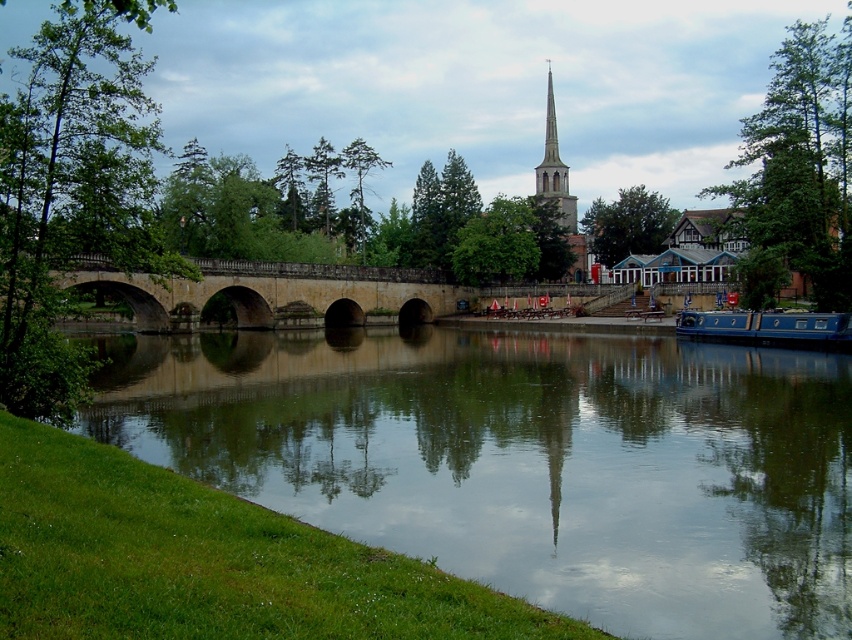
You are standing at the point with coordinates of 0.5, 0.3. Which object is closest to you? The stone bridge at center or the church?

The stone bridge at center is closest because it is located at point (273, 292), which is closer to your position at (255, 320) than the church.

Consider the image. You are standing on the green grassy bank at lower left and want to reach the blue polished wood boat at lower right. Which direction should you move to get there?

You should move to the right because the green grassy bank at lower left is positioned under the blue polished wood boat at lower right, indicating the boat is to the right of the bank.